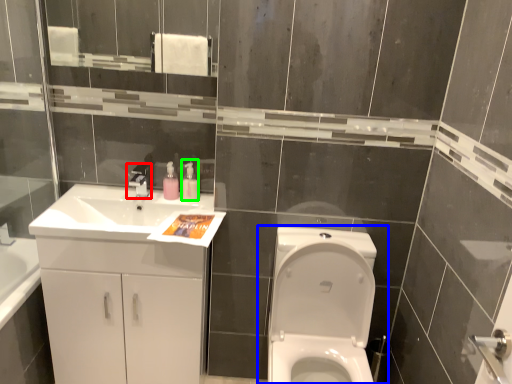
Question: Which is nearer to the tap (highlighted by a red box)? toilet (highlighted by a blue box) or soap dispenser (highlighted by a green box).

Choices:
 (A) toilet
 (B) soap dispenser

Answer: (B)